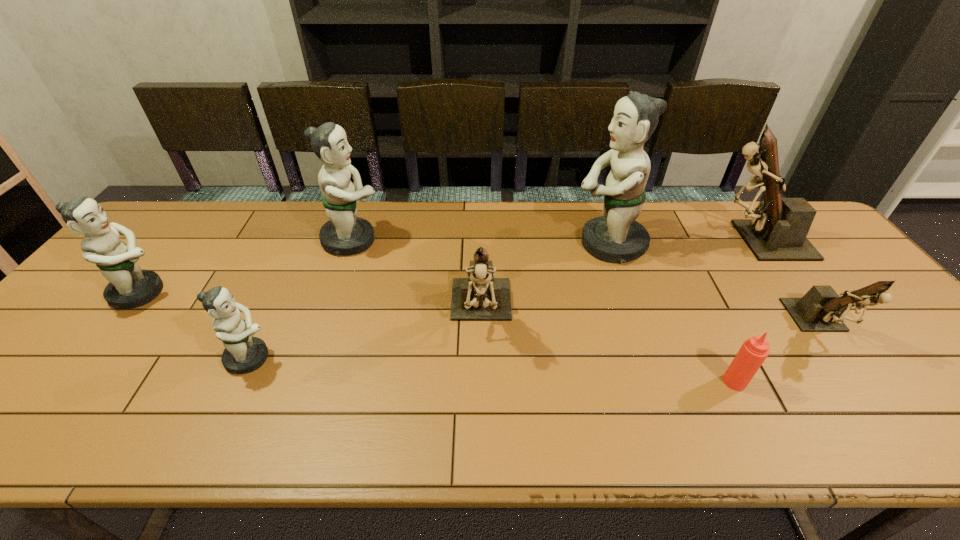
Identify the location of blank area at the near left corner. This screenshot has width=960, height=540. (30, 442).

In order to click on vacant space in between the leftmost green figurine and the fourth object from right to left in this screenshot , I will do `click(374, 268)`.

Identify the location of vacant area that lies between the tallest figurine and the third smallest green figurine. click(480, 242).

The width and height of the screenshot is (960, 540). I want to click on free space between the biggest brown figurine and the fifth object from right to left, so click(618, 276).

At what (x,y) coordinates should I click in order to perform the action: click on empty space between the smallest brown figurine and the fifth figurine from left to right. Please return your answer as a coordinate pair (x, y). The height and width of the screenshot is (540, 960). Looking at the image, I should click on (x=714, y=285).

Image resolution: width=960 pixels, height=540 pixels. I want to click on empty space between the leftmost brown figurine and the second biggest green figurine, so click(417, 276).

Where is `vacant space in between the farthest brown figurine and the third biggest green figurine`? This screenshot has height=540, width=960. vacant space in between the farthest brown figurine and the third biggest green figurine is located at coordinates (448, 267).

Locate an element on the screen. The height and width of the screenshot is (540, 960). free spot between the leftmost brown figurine and the third smallest green figurine is located at coordinates (417, 276).

The width and height of the screenshot is (960, 540). Identify the location of vacant region between the third farthest green figurine and the fourth figurine from right to left. (311, 303).

The width and height of the screenshot is (960, 540). Identify the location of vacant point located between the farthest brown figurine and the rightmost green figurine. (682, 242).